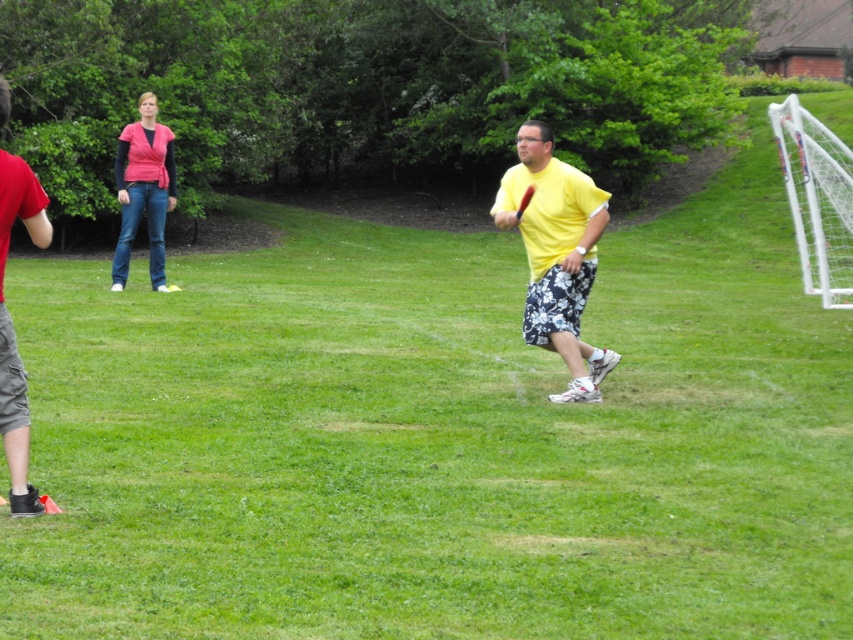
How distant is yellow matte shirt at center from red cotton shirt at left?

yellow matte shirt at center and red cotton shirt at left are 3.37 meters apart from each other.

Based on the photo, which is more to the right, yellow matte shirt at center or red cotton shirt at left?

Positioned to the right is yellow matte shirt at center.

Who is more forward, (587,218) or (13,435)?

Positioned in front is point (13,435).

Image resolution: width=853 pixels, height=640 pixels. Identify the location of yellow matte shirt at center. (556, 253).

Does point (537, 260) come farther from viewer compared to point (164, 179)?

No, (537, 260) is closer to viewer.

Is yellow matte shirt at center to the right of matte pink shirt at upper left from the viewer's perspective?

Indeed, yellow matte shirt at center is positioned on the right side of matte pink shirt at upper left.

You are a GUI agent. You are given a task and a screenshot of the screen. Output one action in this format:
    pyautogui.click(x=<x>, y=<y>)
    Task: Click on the yellow matte shirt at center
    This screenshot has width=853, height=640.
    Given the screenshot: What is the action you would take?
    pyautogui.click(x=556, y=253)

Who is taller, red cotton shirt at left or matte pink shirt at upper left?

matte pink shirt at upper left is taller.

Does red cotton shirt at left appear over matte pink shirt at upper left?

Actually, red cotton shirt at left is below matte pink shirt at upper left.

Between point (9, 320) and point (173, 177), which one is positioned behind?

The point (173, 177) is behind.

The height and width of the screenshot is (640, 853). Find the location of `red cotton shirt at left`. red cotton shirt at left is located at coordinates (12, 326).